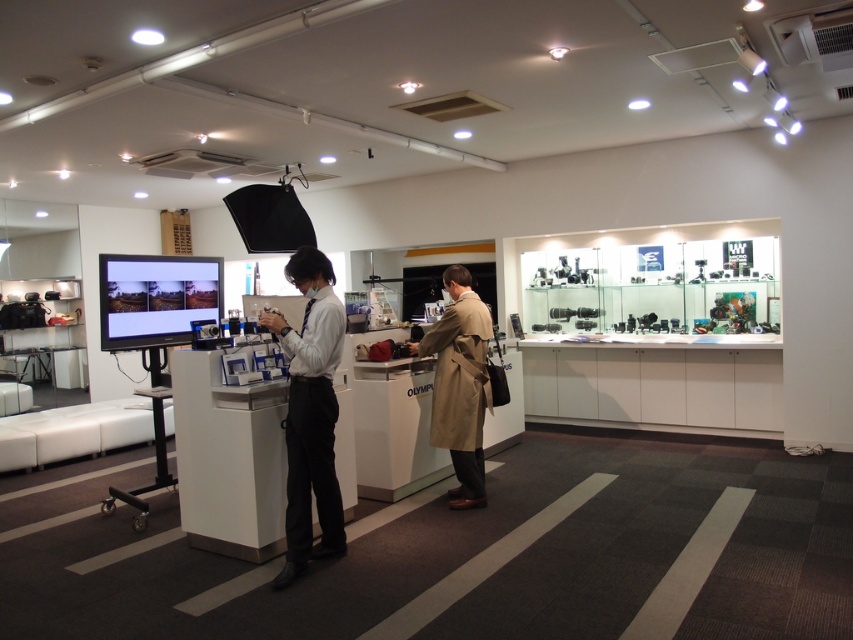
Is the position of white shirt at center less distant than that of tan leather trench coat at center?

Yes, white shirt at center is in front of tan leather trench coat at center.

Is white shirt at center shorter than tan leather trench coat at center?

No.

Find the location of a particular element. The width and height of the screenshot is (853, 640). white shirt at center is located at coordinates (310, 413).